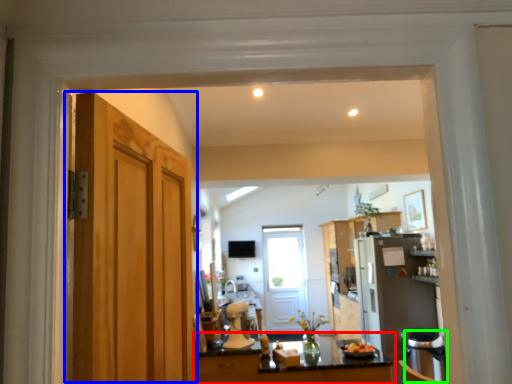
Question: Which object is the closest to the countertop (highlighted by a red box)? Choose among these: door (highlighted by a blue box) or dish washer (highlighted by a green box).

Choices:
 (A) door
 (B) dish washer

Answer: (B)